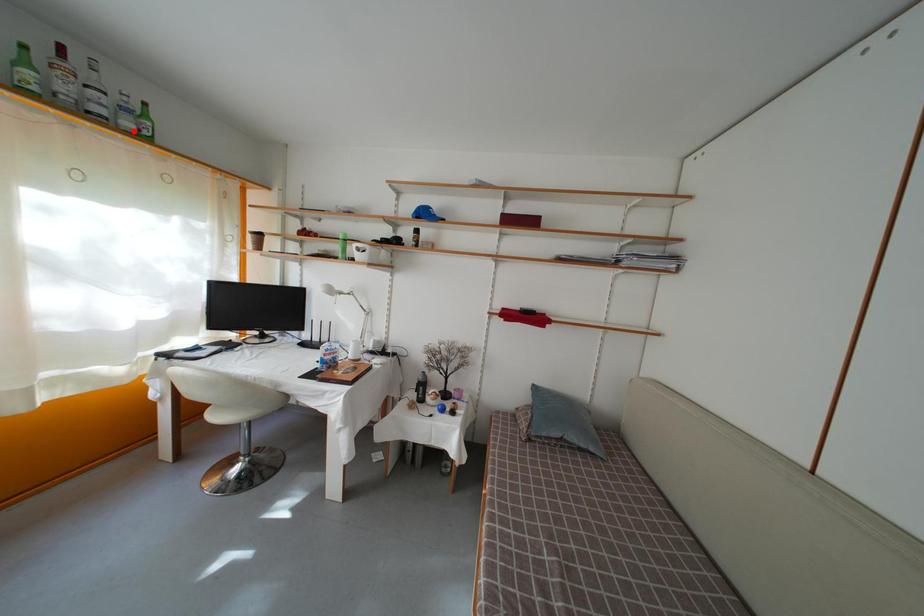
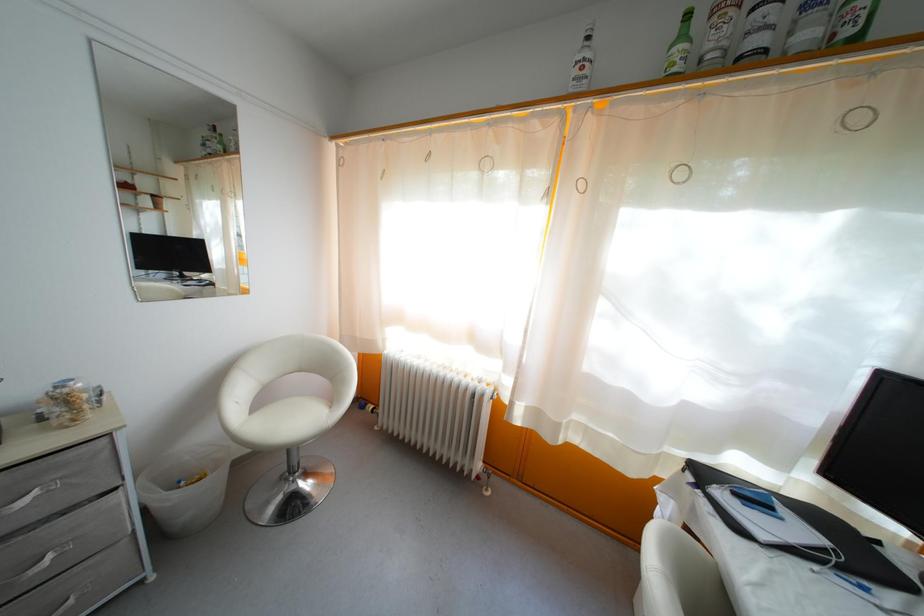
Find the pixel in the second image that matches the highlighted location in the first image.

(812, 42)